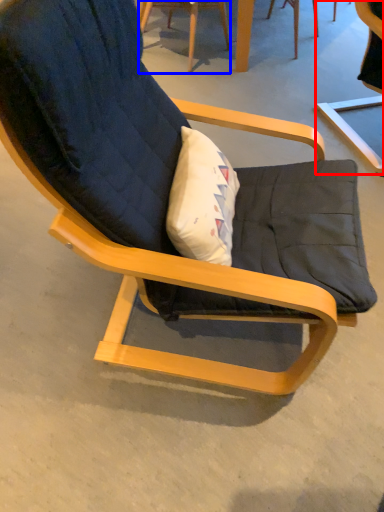
Question: Among these objects, which one is nearest to the camera, chair (highlighted by a red box) or chair (highlighted by a blue box)?

Choices:
 (A) chair
 (B) chair

Answer: (A)